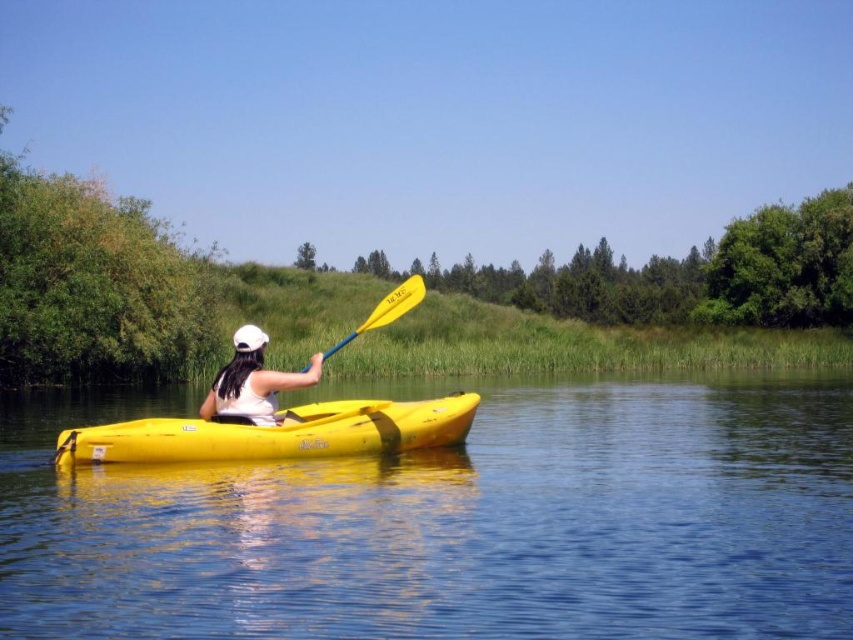
Question: Which object appears closest to the camera in this image?

Choices:
 (A) yellow plastic kayak at center
 (B) yellow matte kayak at center
 (C) white matte kayak at center

Answer: (A)

Question: Which is nearer to the yellow matte kayak at center?

Choices:
 (A) white matte kayak at center
 (B) yellow plastic kayak at center

Answer: (A)

Question: Does yellow matte kayak at center appear under yellow plastic paddle at center?

Choices:
 (A) no
 (B) yes

Answer: (B)

Question: Which object is the farthest from the yellow plastic kayak at center?

Choices:
 (A) yellow matte kayak at center
 (B) yellow plastic paddle at center
 (C) white matte kayak at center

Answer: (A)

Question: Is yellow plastic kayak at center bigger than yellow plastic paddle at center?

Choices:
 (A) yes
 (B) no

Answer: (B)

Question: Does yellow plastic kayak at center have a smaller size compared to yellow matte kayak at center?

Choices:
 (A) no
 (B) yes

Answer: (A)